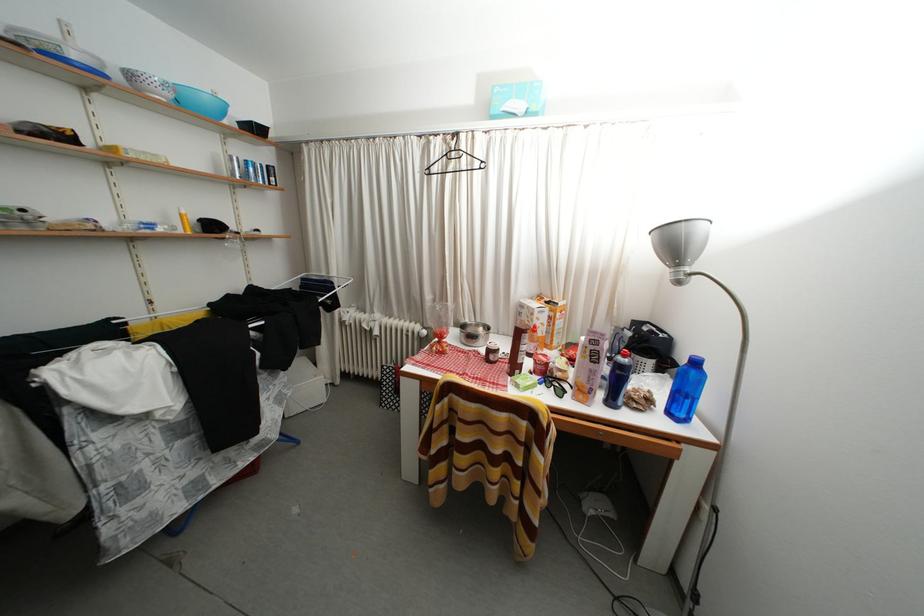
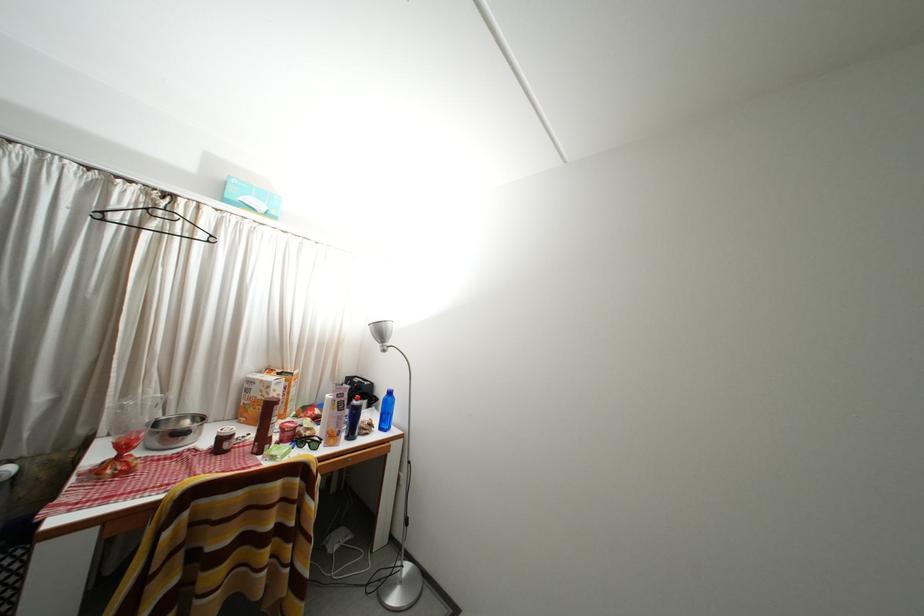
The point at [681,251] is marked in the first image. Where is the corresponding point in the second image?

(388, 338)